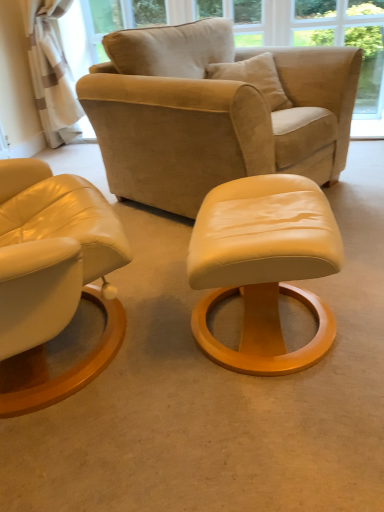
This screenshot has width=384, height=512. In order to click on vacant space underneath matte cream leather ottoman at center (from a real-world perspective) in this screenshot , I will do `click(279, 326)`.